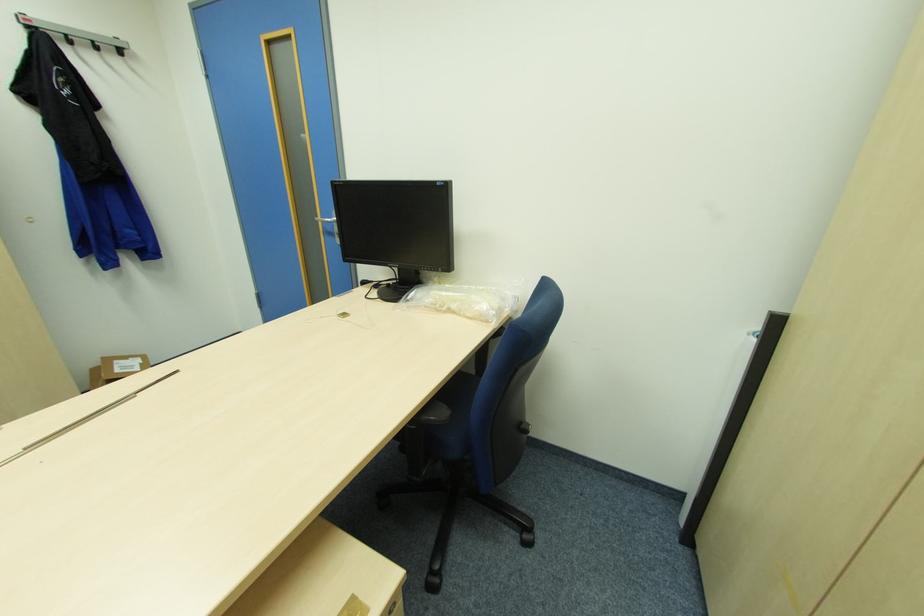
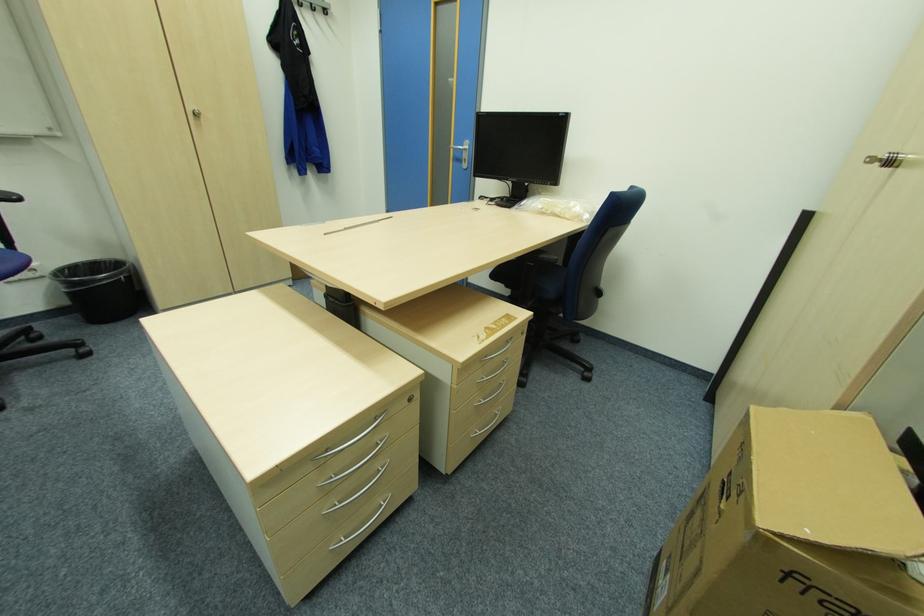
In the second image, find the point that corresponds to pixel 99 47 in the first image.

(315, 7)